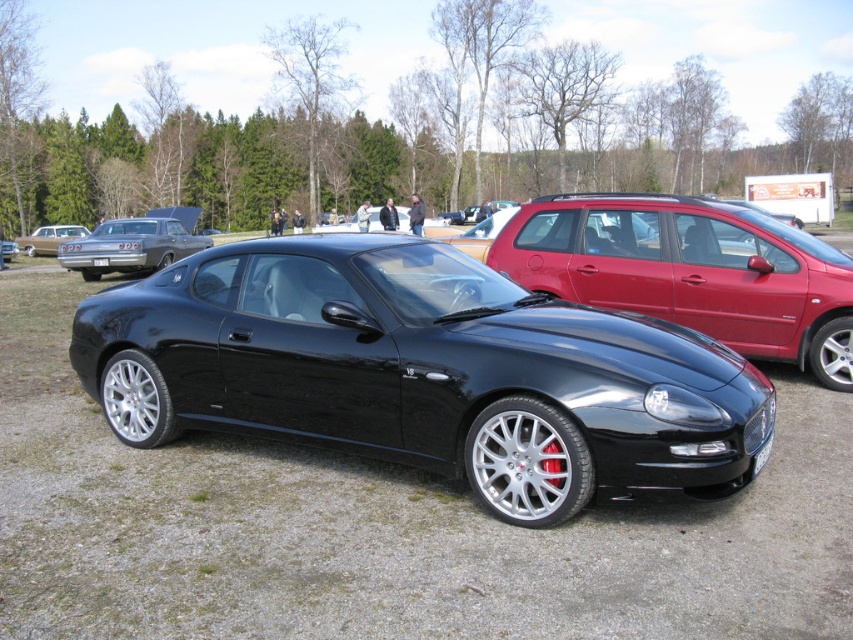
Does matte silver classic car at left have a greater width compared to white plastic license plate at front?

Yes, matte silver classic car at left is wider than white plastic license plate at front.

Who is more forward, (51, 230) or (759, 468)?

Positioned in front is point (759, 468).

I want to click on matte silver classic car at left, so 48,237.

Which is more to the right, matte silver sedan at upper left or matte silver classic car at left?

matte silver sedan at upper left is more to the right.

Between point (126, 260) and point (61, 228), which one is positioned behind?

Point (61, 228)

Between point (86, 273) and point (47, 237), which one is positioned behind?

The point (47, 237) is more distant.

Where is `matte silver sedan at upper left`? This screenshot has width=853, height=640. matte silver sedan at upper left is located at coordinates pos(131,244).

Can you confirm if glossy black car at center is taller than matte silver sedan at upper left?

Indeed, glossy black car at center has a greater height compared to matte silver sedan at upper left.

This screenshot has width=853, height=640. Describe the element at coordinates (688, 272) in the screenshot. I see `glossy black car at center` at that location.

Find the location of `glossy black car at center`. glossy black car at center is located at coordinates (688, 272).